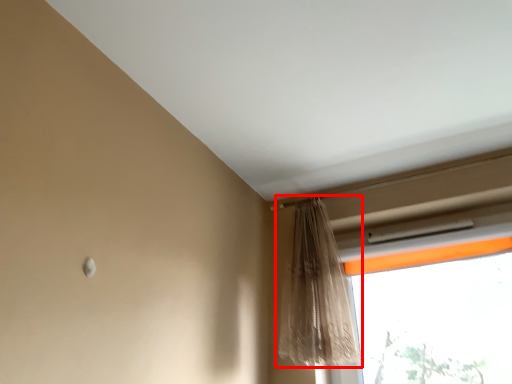
Question: From the image's perspective, what is the correct spatial relationship of curtain (annotated by the red box) in relation to window?

Choices:
 (A) below
 (B) above

Answer: (B)